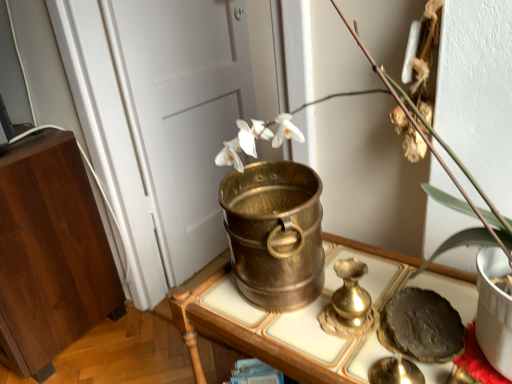
Where is `vacant space in white porcelain vase at center (from a real-world perspective)`? vacant space in white porcelain vase at center (from a real-world perspective) is located at coordinates (400, 291).